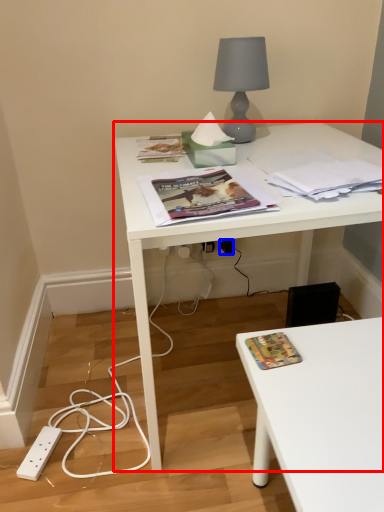
Question: Which object is closer to the camera taking this photo, desk (highlighted by a red box) or electric outlet (highlighted by a blue box)?

Choices:
 (A) desk
 (B) electric outlet

Answer: (A)